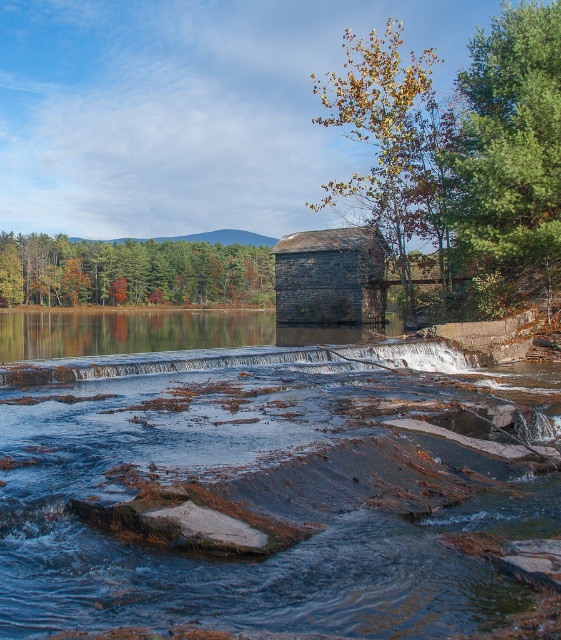
Does green textured pine tree at upper right come behind smooth stone waterfall at center?

Yes, green textured pine tree at upper right is behind smooth stone waterfall at center.

Does green textured pine tree at upper right have a larger size compared to smooth stone waterfall at center?

Indeed, green textured pine tree at upper right has a larger size compared to smooth stone waterfall at center.

Does point (528, 90) come in front of point (50, 362)?

No, (528, 90) is behind (50, 362).

Image resolution: width=561 pixels, height=640 pixels. Identify the location of green textured pine tree at upper right. (511, 141).

Who is positioned more to the left, green matte tree at upper left or smooth stone waterfall at center?

From the viewer's perspective, green matte tree at upper left appears more on the left side.

Can you confirm if green matte tree at upper left is positioned to the right of smooth stone waterfall at center?

In fact, green matte tree at upper left is to the left of smooth stone waterfall at center.

Is point (123, 294) in front of point (93, 380)?

That is False.

At what (x,y) coordinates should I click in order to perform the action: click on green matte tree at upper left. Please return your answer as a coordinate pair (x, y). Looking at the image, I should click on (131, 272).

Between yellow-green foliage at upper center and green matte tree at upper left, which one is positioned higher?

yellow-green foliage at upper center

Based on the photo, can you confirm if yellow-green foliage at upper center is wider than green matte tree at upper left?

In fact, yellow-green foliage at upper center might be narrower than green matte tree at upper left.

The image size is (561, 640). What do you see at coordinates (389, 141) in the screenshot? I see `yellow-green foliage at upper center` at bounding box center [389, 141].

Identify the location of yellow-green foliage at upper center. The width and height of the screenshot is (561, 640). (389, 141).